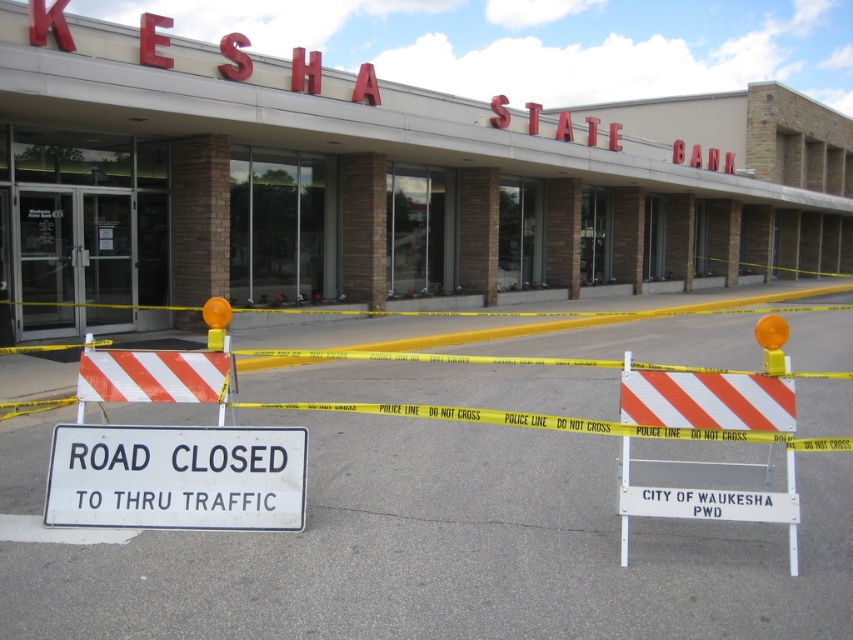
Between white plastic sign at center and white plastic barricade at center, which one appears on the right side from the viewer's perspective?

From the viewer's perspective, white plastic barricade at center appears more on the right side.

Does white plastic sign at center appear over white plastic barricade at center?

Actually, white plastic sign at center is below white plastic barricade at center.

Who is more distant from viewer, (125, 476) or (700, 424)?

Point (125, 476)

Locate an element on the screen. white plastic sign at center is located at coordinates (177, 477).

Based on the photo, can you confirm if brick wall at center is positioned to the left of white plastic barricade at center?

No, brick wall at center is not to the left of white plastic barricade at center.

Is brick wall at center thinner than white plastic barricade at center?

In fact, brick wall at center might be wider than white plastic barricade at center.

Does point (770, 113) come farther from viewer compared to point (664, 401)?

That is True.

The width and height of the screenshot is (853, 640). Identify the location of brick wall at center. (374, 184).

Can you confirm if brick wall at center is thinner than white plastic sign at center?

Incorrect, brick wall at center's width is not less than white plastic sign at center's.

Is brick wall at center bigger than white plastic sign at center?

Yes.

The image size is (853, 640). Identify the location of brick wall at center. (374, 184).

Find the location of `brick wall at center`. brick wall at center is located at coordinates (374, 184).